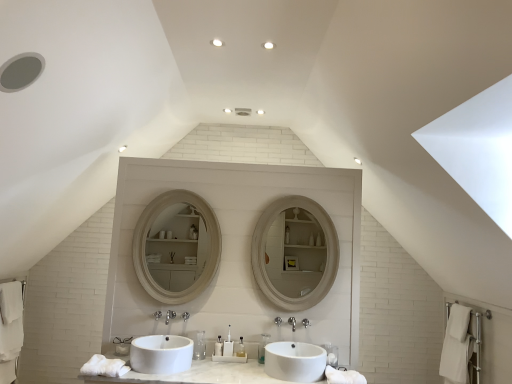
Identify the location of brushed metal faucet at center, the first plumbing fixture from the left. This screenshot has width=512, height=384. (157, 315).

The width and height of the screenshot is (512, 384). Identify the location of clear plastic bottle at center, the 6th toiletry from the right. (199, 346).

Measure the distance between point (172, 366) and camera.

Point (172, 366) is 2.75 meters from camera.

What is the approximate width of translucent plastic toothbrush at center, arranged as the 6th toiletry when viewed from the left?

translucent plastic toothbrush at center, arranged as the 6th toiletry when viewed from the left, is 3.12 inches in width.

How much space does polished chrome faucet at center, acting as the 1th plumbing fixture starting from the right, occupy vertically?

It is 3.26 inches.

Where is `brushed metal faucet at center, the first plumbing fixture from the left`? brushed metal faucet at center, the first plumbing fixture from the left is located at coordinates (157, 315).

Considering the sizes of objects white cotton bath towel at lower left, the first bath towel in the left-to-right sequence, and white glossy sink at center, the first sink viewed from the right, in the image provided, who is taller, white cotton bath towel at lower left, the first bath towel in the left-to-right sequence, or white glossy sink at center, the first sink viewed from the right,?

With more height is white cotton bath towel at lower left, the first bath towel in the left-to-right sequence.

At what (x,y) coordinates should I click in order to perform the action: click on bath towel that is the 2nd one when counting backward from the white glossy sink at center, the first sink viewed from the right. Please return your answer as a coordinate pair (x, y). Image resolution: width=512 pixels, height=384 pixels. Looking at the image, I should click on [10, 328].

Would you say white glossy sink at center, the first sink viewed from the right, is part of white cotton bath towel at lower left, which is the 3th bath towel from right to left,'s contents?

No, white glossy sink at center, the first sink viewed from the right, is located outside of white cotton bath towel at lower left, which is the 3th bath towel from right to left.

Between white cotton bath towel at lower left, which is the third bath towel from front to back, and white glossy sink at center, which ranks as the 2th sink in left-to-right order, which one has smaller size?

With smaller size is white glossy sink at center, which ranks as the 2th sink in left-to-right order.

Between translucent plastic toiletries at center, the third toiletry positioned from the right, and white cotton bath towel at lower left, which is counted as the first bath towel, starting from the back, which one has smaller width?

With smaller width is translucent plastic toiletries at center, the third toiletry positioned from the right.

Locate an element on the screen. This screenshot has height=384, width=512. the 6th toiletry directly above the white cotton bath towel at lower left, which is the 3th bath towel from right to left (from a real-world perspective) is located at coordinates (229, 334).

Is translucent plastic toiletries at center, the third toiletry positioned from the right, directly adjacent to white cotton bath towel at lower left, which is the third bath towel from front to back?

There is a gap between translucent plastic toiletries at center, the third toiletry positioned from the right, and white cotton bath towel at lower left, which is the third bath towel from front to back.

Considering the relative sizes of translucent plastic toiletries at center, arranged as the fourth toiletry when viewed from the left, and white cotton bath towel at lower left, which is the third bath towel from front to back, in the image provided, is translucent plastic toiletries at center, arranged as the fourth toiletry when viewed from the left, bigger than white cotton bath towel at lower left, which is the third bath towel from front to back,?

Actually, translucent plastic toiletries at center, arranged as the fourth toiletry when viewed from the left, might be smaller than white cotton bath towel at lower left, which is the third bath towel from front to back.

Can you tell me how much clear plastic toothbrush at center, acting as the 2th toiletry starting from the right, and clear plastic bottle at center, the 1th toiletry positioned from the left, differ in facing direction?

0.638 degrees.

Consider the image. From a real-world perspective, which object stands above the other?

clear plastic bottle at center, the 1th toiletry positioned from the left, is physically above.

Relative to clear plastic bottle at center, the 6th toiletry from the right, is clear plastic toothbrush at center, the fifth toiletry positioned from the left, in front or behind?

In the image, clear plastic toothbrush at center, the fifth toiletry positioned from the left, appears behind clear plastic bottle at center, the 6th toiletry from the right.

Would you say clear plastic toothbrush at center, the fifth toiletry positioned from the left, contains clear plastic bottle at center, the 6th toiletry from the right?

No, clear plastic toothbrush at center, the fifth toiletry positioned from the left, does not contain clear plastic bottle at center, the 6th toiletry from the right.

Which is more to the right, translucent plastic toothbrush at center, which is counted as the third toiletry, starting from the left, or white cotton bath towel at lower left, which is the third bath towel from front to back?

From the viewer's perspective, translucent plastic toothbrush at center, which is counted as the third toiletry, starting from the left, appears more on the right side.

What's the angular difference between translucent plastic toothbrush at center, arranged as the 4th toiletry when viewed from the right, and white cotton bath towel at lower left, the first bath towel in the left-to-right sequence,'s facing directions?

The angle between the facing direction of translucent plastic toothbrush at center, arranged as the 4th toiletry when viewed from the right, and the facing direction of white cotton bath towel at lower left, the first bath towel in the left-to-right sequence, is 91.5 degrees.

Which of these two, translucent plastic toothbrush at center, which is counted as the third toiletry, starting from the left, or white cotton bath towel at lower left, which is counted as the first bath towel, starting from the back, is smaller?

translucent plastic toothbrush at center, which is counted as the third toiletry, starting from the left.

Could you tell me if translucent plastic toothbrush at center, arranged as the 4th toiletry when viewed from the right, is facing white cotton bath towel at lower left, which is the third bath towel from front to back?

No, translucent plastic toothbrush at center, arranged as the 4th toiletry when viewed from the right, does not turn towards white cotton bath towel at lower left, which is the third bath towel from front to back.

There is a satin nickel faucet at center. Where is `the 4th toiletry below it (from the image's perspective)`? This screenshot has height=384, width=512. the 4th toiletry below it (from the image's perspective) is located at coordinates (262, 347).

Are translucent plastic toothbrush at center, arranged as the 6th toiletry when viewed from the left, and satin nickel faucet at center far apart?

That's not correct — translucent plastic toothbrush at center, arranged as the 6th toiletry when viewed from the left, is a little close to satin nickel faucet at center.

From the picture: Is translucent plastic toothbrush at center, the 1th toiletry in the right-to-left sequence, facing away from satin nickel faucet at center?

No, translucent plastic toothbrush at center, the 1th toiletry in the right-to-left sequence, is not facing the opposite direction of satin nickel faucet at center.

From a real-world perspective, who is located lower, translucent plastic toothbrush at center, the 1th toiletry in the right-to-left sequence, or satin nickel faucet at center?

translucent plastic toothbrush at center, the 1th toiletry in the right-to-left sequence, is physically lower.

Which is closer, (x=116, y=366) or (x=155, y=315)?

Answer: Point (x=116, y=366) appears to be closer to the viewer than point (x=155, y=315).

From the picture: Is white soft towel at lower left, which appears as the 2th bath towel when viewed from the left, directly adjacent to brushed metal faucet at center, which is the 2th plumbing fixture from right to left?

No, white soft towel at lower left, which appears as the 2th bath towel when viewed from the left, is not in contact with brushed metal faucet at center, which is the 2th plumbing fixture from right to left.

From a real-world perspective, is white soft towel at lower left, which appears as the 2th bath towel when viewed from the left, positioned above or below brushed metal faucet at center, which is the 2th plumbing fixture from right to left?

white soft towel at lower left, which appears as the 2th bath towel when viewed from the left, is situated lower than brushed metal faucet at center, which is the 2th plumbing fixture from right to left, in the real world.

Can you tell me how much white soft towel at lower left, placed as the 1th bath towel when sorted from front to back, and brushed metal faucet at center, which is the 2th plumbing fixture from right to left, differ in facing direction?

They differ by 0.481 degrees in their facing directions.

Consider the image. How many degrees apart are the facing directions of satin nickel faucet at center and polished chrome faucet at center, acting as the 1th plumbing fixture starting from the right?

0.000786 degrees separate the facing orientations of satin nickel faucet at center and polished chrome faucet at center, acting as the 1th plumbing fixture starting from the right.

Which of these two, satin nickel faucet at center or polished chrome faucet at center, which is the second plumbing fixture from left to right, stands shorter?

Standing shorter between the two is polished chrome faucet at center, which is the second plumbing fixture from left to right.

Who is bigger, satin nickel faucet at center or polished chrome faucet at center, acting as the 1th plumbing fixture starting from the right?

satin nickel faucet at center is bigger.

In the scene shown: Is satin nickel faucet at center closer to the viewer compared to polished chrome faucet at center, which is the second plumbing fixture from left to right?

Yes, it is.

From the white cotton bath towel at lower left, which is the 3th bath towel from right to left, count 1st sinks forward and point to it. Please provide its 2D coordinates.

[(295, 361)]

From a real-world perspective, which bath towel is the 3rd one underneath the translucent plastic toiletries at center, arranged as the fourth toiletry when viewed from the left? Please provide its 2D coordinates.

[(10, 328)]

Based on their spatial positions, is white glossy sink at center, which ranks as the 2th sink in left-to-right order, or translucent plastic toiletries at center, the third toiletry positioned from the right, closer to white glossy sink at center, positioned as the first sink in left-to-right order?

translucent plastic toiletries at center, the third toiletry positioned from the right, lies closer to white glossy sink at center, positioned as the first sink in left-to-right order, than the other object.

Looking at this image, looking at the image, which one is located further to translucent plastic toothbrush at center, which is counted as the third toiletry, starting from the left, translucent plastic toothbrush at center, the second toiletry from the left, or white glossy sink at center, which ranks as the 2th sink in left-to-right order?

white glossy sink at center, which ranks as the 2th sink in left-to-right order, is further to translucent plastic toothbrush at center, which is counted as the third toiletry, starting from the left.

Looking at the image, which one is located further to satin nickel faucet at center, white cotton bath towel at lower left, which is the third bath towel from front to back, or matte white mirror at center?

matte white mirror at center lies further to satin nickel faucet at center than the other object.

From the image, which object appears to be farther from polished chrome faucet at center, acting as the 1th plumbing fixture starting from the right, satin nickel faucet at center or translucent plastic toothbrush at center, arranged as the 6th toiletry when viewed from the left?

Among the two, translucent plastic toothbrush at center, arranged as the 6th toiletry when viewed from the left, is located further to polished chrome faucet at center, acting as the 1th plumbing fixture starting from the right.

Looking at this image, based on their spatial positions, is polished chrome faucet at center, which is the second plumbing fixture from left to right, or white glossy sink at center, the first sink viewed from the right, further from white cotton bath towel at lower right, which is the 2th bath towel from front to back?

polished chrome faucet at center, which is the second plumbing fixture from left to right, is further to white cotton bath towel at lower right, which is the 2th bath towel from front to back.

Considering their positions, is polished chrome faucet at center, acting as the 1th plumbing fixture starting from the right, positioned closer to white soft towel at lower left, which ranks as the 3th bath towel in back-to-front order, than translucent plastic toothbrush at center, arranged as the 6th toiletry when viewed from the left?

The object closer to white soft towel at lower left, which ranks as the 3th bath towel in back-to-front order, is polished chrome faucet at center, acting as the 1th plumbing fixture starting from the right.

When comparing their distances from translucent plastic toiletries at center, arranged as the fourth toiletry when viewed from the left, does brushed metal faucet at center, which is the 2th plumbing fixture from right to left, or translucent plastic toothbrush at center, acting as the fifth toiletry starting from the right, seem further?

brushed metal faucet at center, which is the 2th plumbing fixture from right to left, is further to translucent plastic toiletries at center, arranged as the fourth toiletry when viewed from the left.

From the image, which object appears to be farther from translucent plastic toothbrush at center, the 1th toiletry in the right-to-left sequence, clear plastic bottle at center, the 1th toiletry positioned from the left, or translucent plastic toothbrush at center, arranged as the 4th toiletry when viewed from the right?

clear plastic bottle at center, the 1th toiletry positioned from the left, is further to translucent plastic toothbrush at center, the 1th toiletry in the right-to-left sequence.

Image resolution: width=512 pixels, height=384 pixels. I want to click on bath towel situated between white cotton bath towel at lower left, which is the 3th bath towel from right to left, and brushed metal faucet at center, which is the 2th plumbing fixture from right to left, from left to right, so click(x=104, y=367).

The width and height of the screenshot is (512, 384). I want to click on tap between white glossy sink at center, positioned as the first sink in left-to-right order, and white glossy sink at center, which ranks as the 2th sink in left-to-right order, in the horizontal direction, so click(170, 316).

You are a GUI agent. You are given a task and a screenshot of the screen. Output one action in this format:
    pyautogui.click(x=<x>, y=<y>)
    Task: Click on the plumbing fixture situated between brushed metal faucet at center, the first plumbing fixture from the left, and translucent plastic toothbrush at center, arranged as the 4th toiletry when viewed from the right, from left to right
    The image size is (512, 384).
    Given the screenshot: What is the action you would take?
    pyautogui.click(x=185, y=316)

I want to click on plumbing fixture between satin nickel faucet at center and white glossy sink at center, which ranks as the 2th sink in left-to-right order, in the horizontal direction, so tap(185, 316).